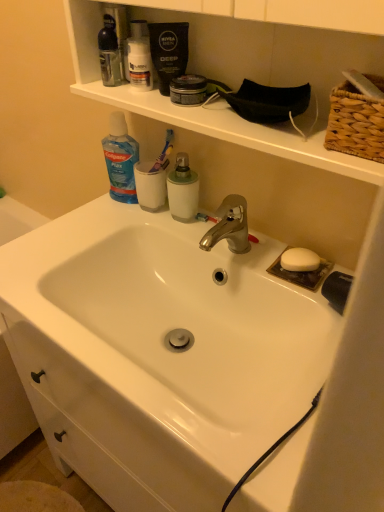
This screenshot has height=512, width=384. What are the coordinates of `vacant region to the left of purple plastic toothbrush at upper center, which is the first toothbrush in left-to-right order` in the screenshot? It's located at (106, 212).